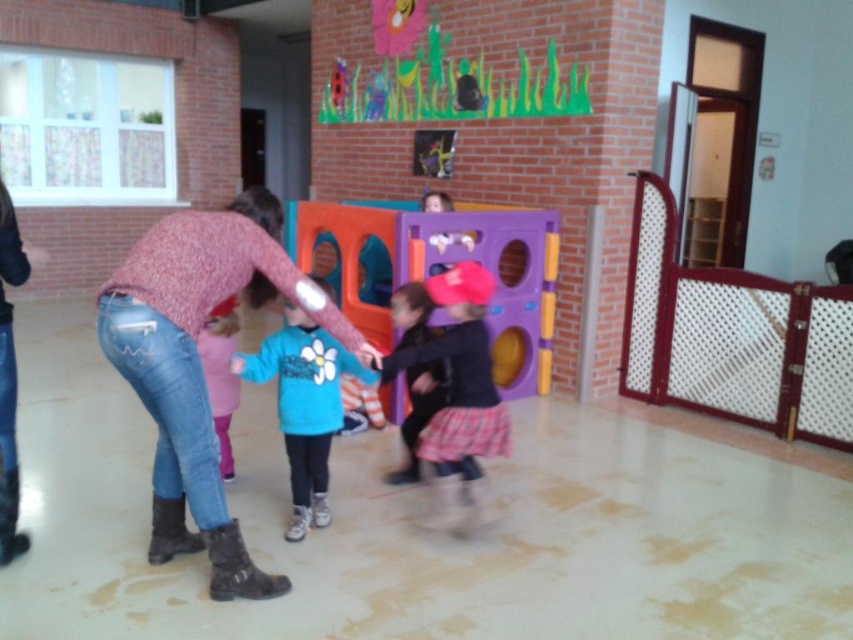
From the picture: You are a parent trying to find your child in a daycare. You remember your child was wearing jeans at center and pink fabric pants at lower left. Based on the scene description, which clothing item is taller?

The jeans at center is taller than the pink fabric pants at lower left.